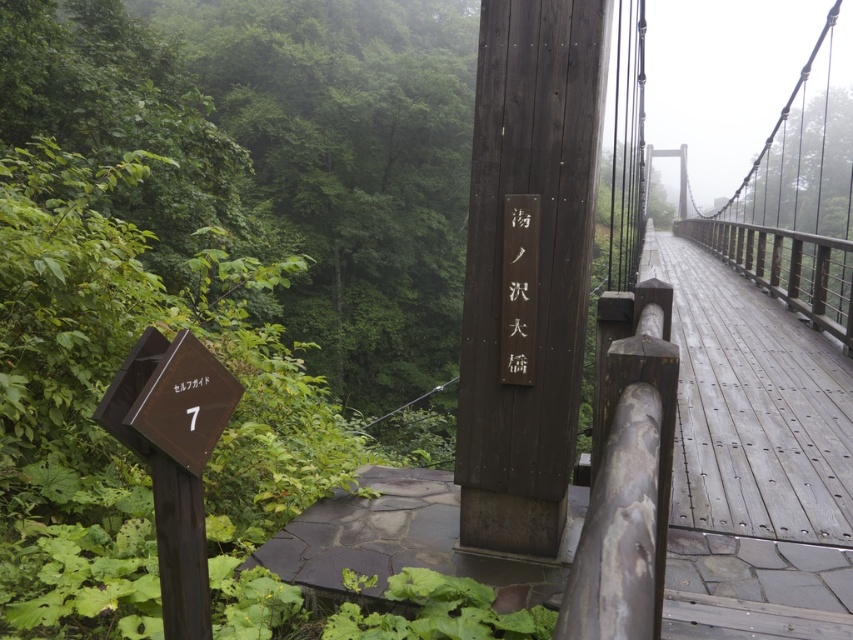
Can you confirm if brown wooden sign at center is bigger than wooden bridge at center?

Incorrect, brown wooden sign at center is not larger than wooden bridge at center.

Is brown wooden sign at center shorter than wooden bridge at center?

Correct, brown wooden sign at center is not as tall as wooden bridge at center.

Locate an element on the screen. The height and width of the screenshot is (640, 853). brown wooden sign at center is located at coordinates 531,266.

From the picture: Is dark brown wooden suspension bridge at center wider than wooden sign at center?

Correct, the width of dark brown wooden suspension bridge at center exceeds that of wooden sign at center.

Can you confirm if dark brown wooden suspension bridge at center is smaller than wooden sign at center?

Incorrect, dark brown wooden suspension bridge at center is not smaller in size than wooden sign at center.

The image size is (853, 640). I want to click on dark brown wooden suspension bridge at center, so click(544, 397).

At what (x,y) coordinates should I click in order to perform the action: click on dark brown wooden suspension bridge at center. Please return your answer as a coordinate pair (x, y). This screenshot has height=640, width=853. Looking at the image, I should click on (544, 397).

Can you confirm if dark brown wooden suspension bridge at center is positioned below brown wooden sign at lower left?

Incorrect, dark brown wooden suspension bridge at center is not positioned below brown wooden sign at lower left.

Where is `dark brown wooden suspension bridge at center`? This screenshot has height=640, width=853. dark brown wooden suspension bridge at center is located at coordinates (544, 397).